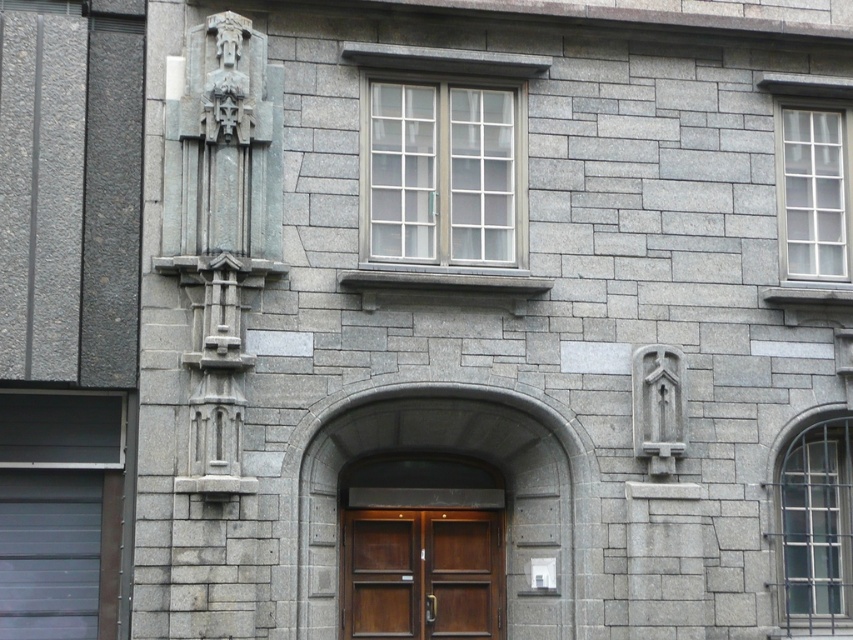
You are standing in front of the building and want to know if the clear glass window at upper right is positioned higher than the clear glass window at center right. Can you confirm this based on their placement?

The clear glass window at upper right is above the clear glass window at center right, so yes, it is positioned higher.